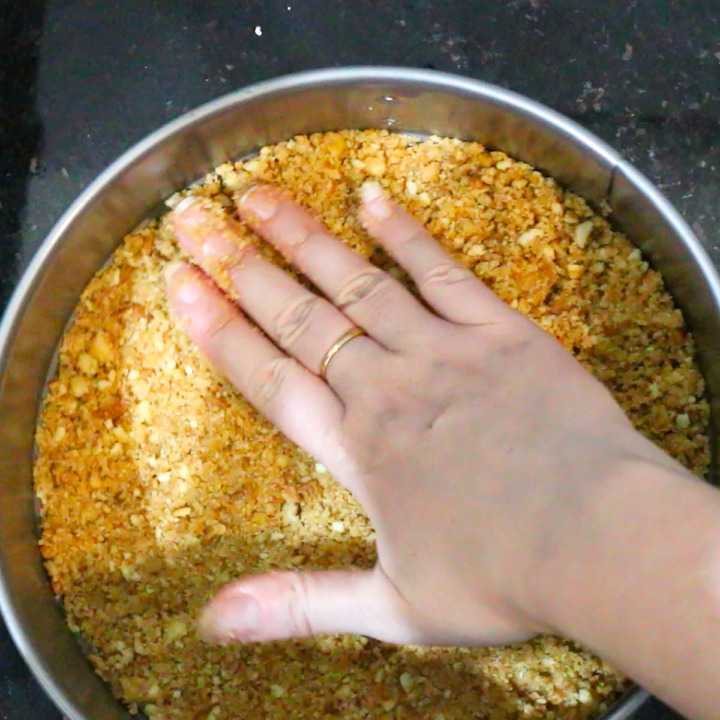
Where is `silver pot or skillet`? silver pot or skillet is located at coordinates (518, 114).